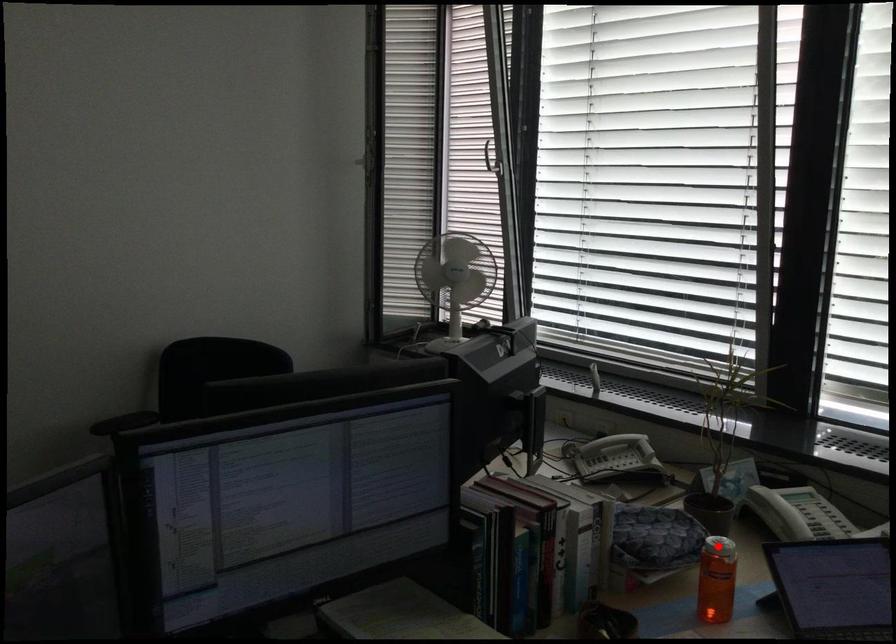
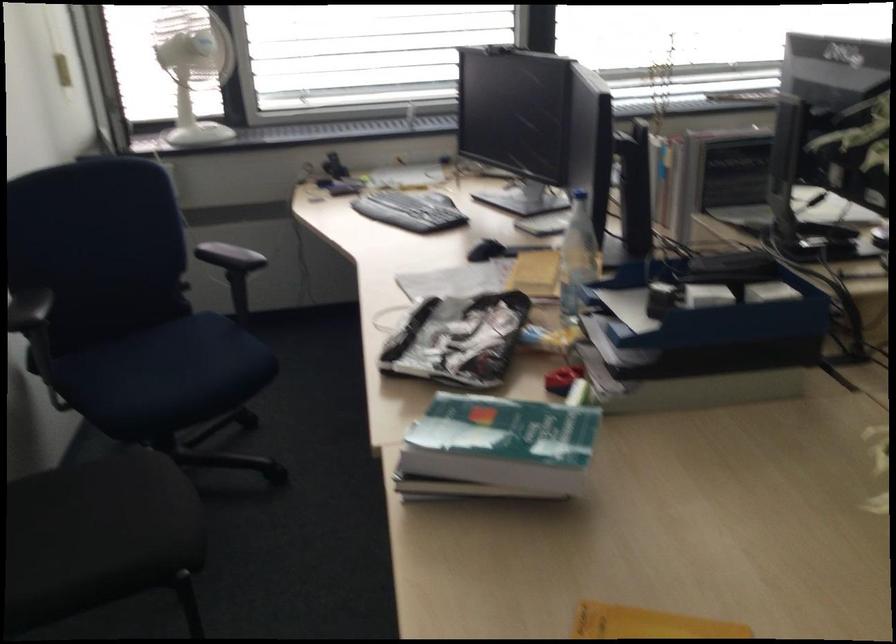
Question: I am providing you with two images of the same scene from different viewpoints. A red point is marked on the first image. Is the red point's position out of view in image 2?

Choices:
 (A) Yes
 (B) No

Answer: (A)